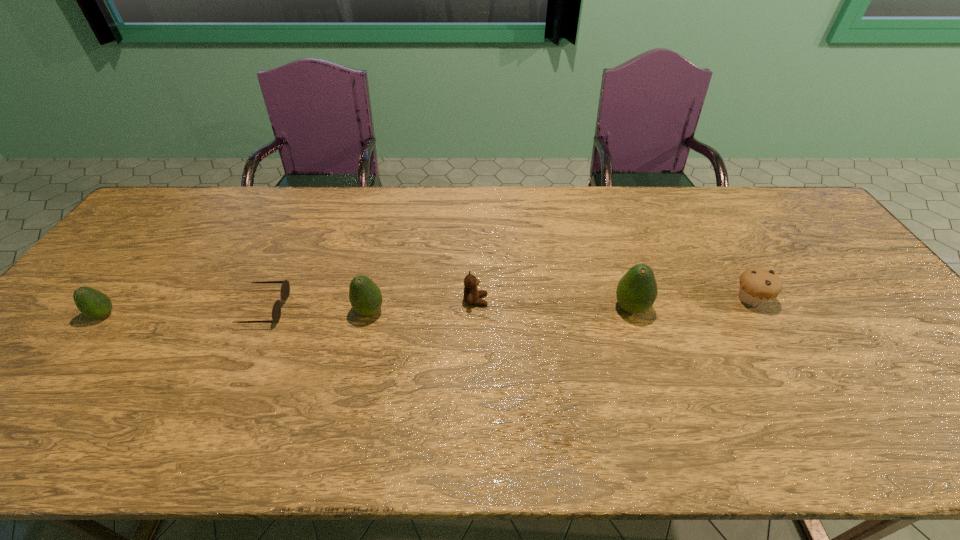
The image size is (960, 540). Find the location of `the leftmost avocado`. the leftmost avocado is located at coordinates (92, 303).

Find the location of a particular element. Image resolution: width=960 pixels, height=540 pixels. the leftmost object is located at coordinates (92, 303).

Locate an element on the screen. the fourth object from right to left is located at coordinates (365, 297).

Locate an element on the screen. Image resolution: width=960 pixels, height=540 pixels. the second tallest object is located at coordinates (365, 297).

Image resolution: width=960 pixels, height=540 pixels. I want to click on the rightmost avocado, so click(637, 290).

Identify the location of the tallest object. (637, 290).

In order to click on teddy bear in this screenshot , I will do `click(472, 295)`.

I want to click on the second object from left to right, so click(285, 288).

Locate an element on the screen. the shortest object is located at coordinates point(285,288).

Find the location of `the rightmost object`. the rightmost object is located at coordinates (758, 285).